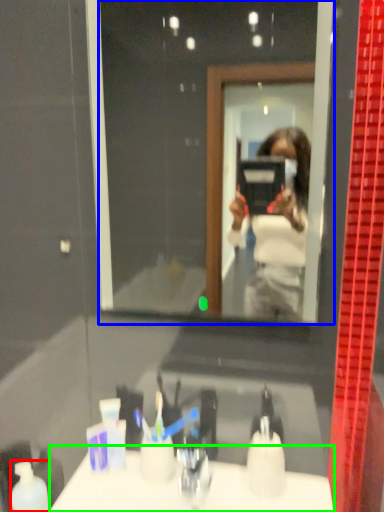
Question: Which object is positioned closest to mouthwash (highlighted by a red box)? Select from mirror (highlighted by a blue box) and counter top (highlighted by a green box).

Choices:
 (A) mirror
 (B) counter top

Answer: (B)